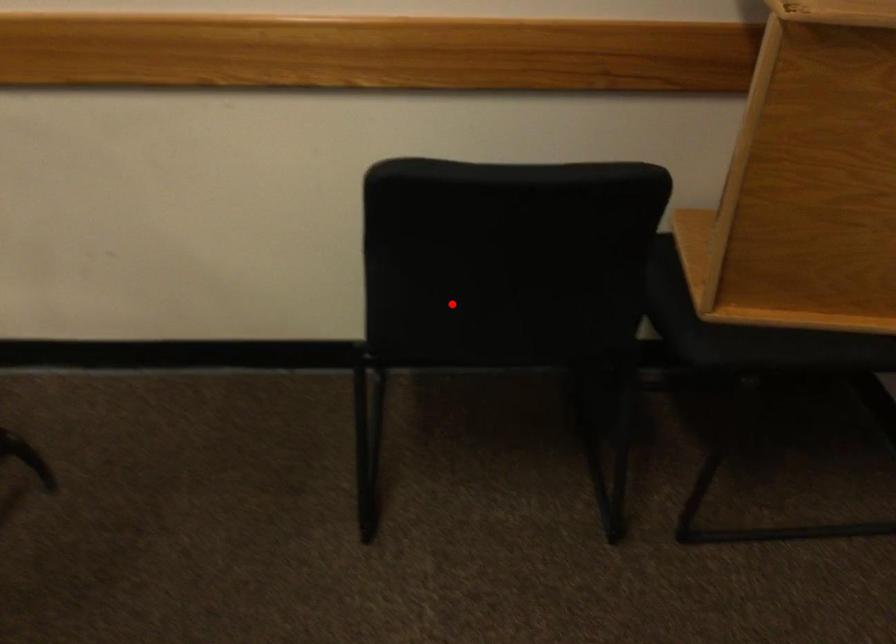
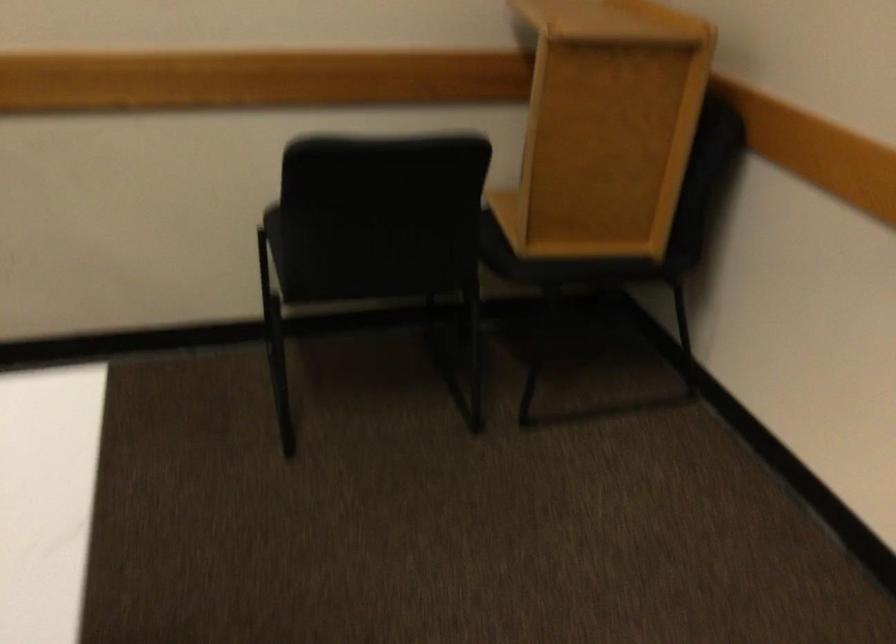
Locate, in the second image, the point that corresponds to the highlighted location in the first image.

(348, 250)